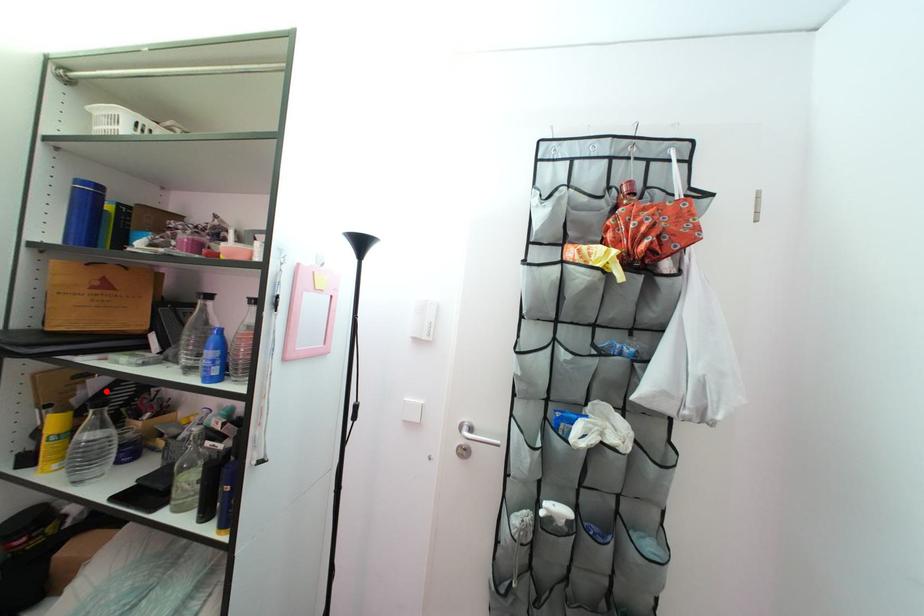
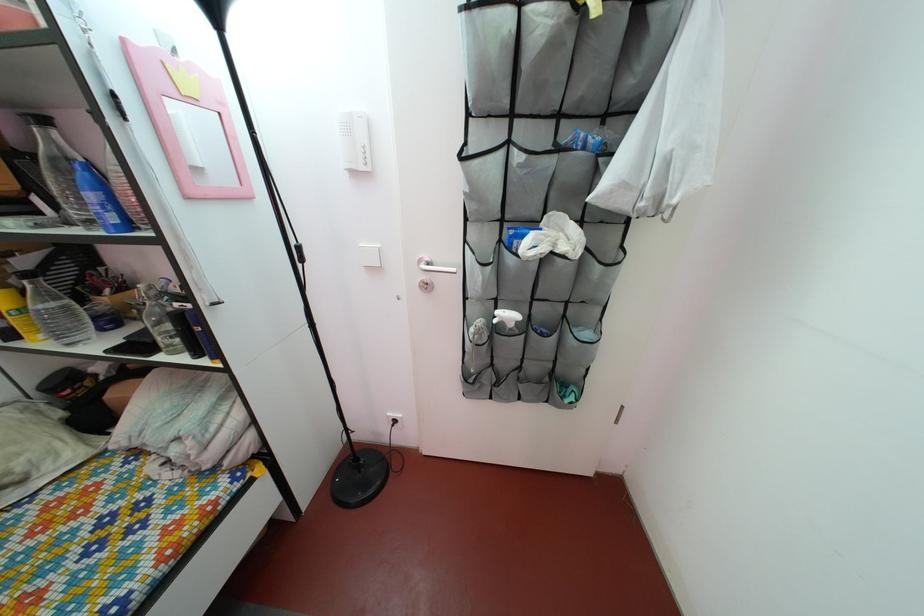
Question: I am providing you with two images of the same scene from different viewpoints. Image1 has a red point marked. In image2, the corresponding 3D location appears at what relative position? Reply with the corresponding letter.

Choices:
 (A) Closer
 (B) Farther

Answer: (B)